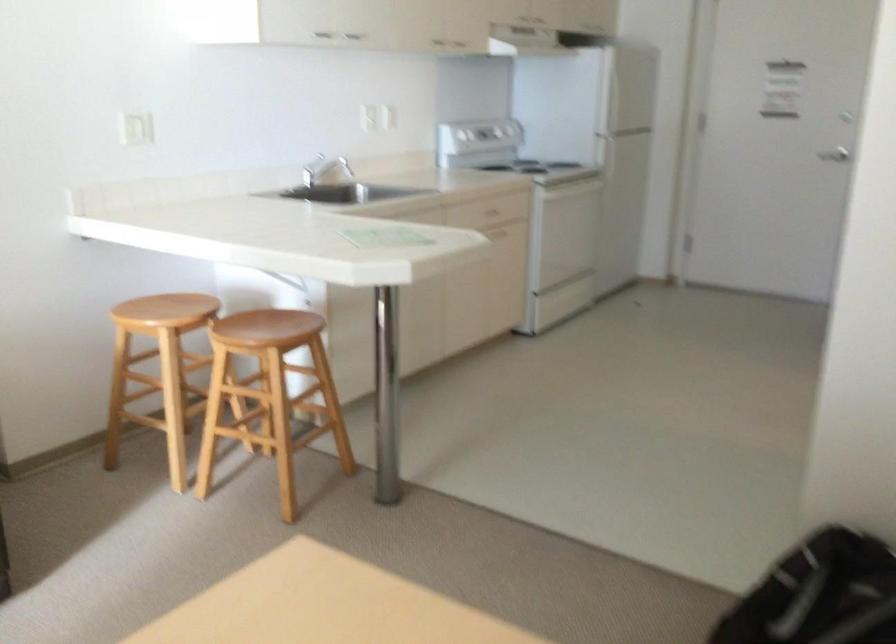
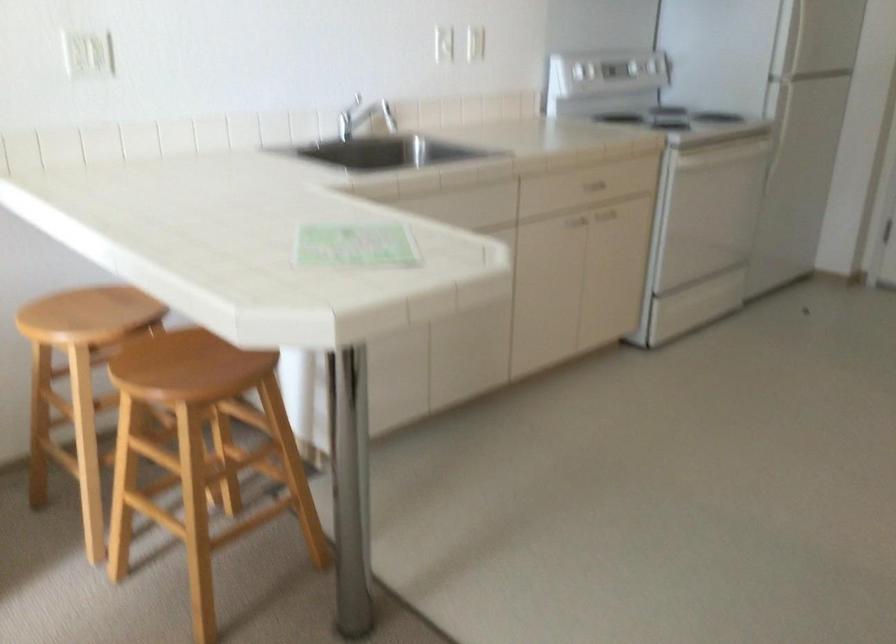
Where in the second image is the point corresponding to [323,158] from the first image?

(375, 111)